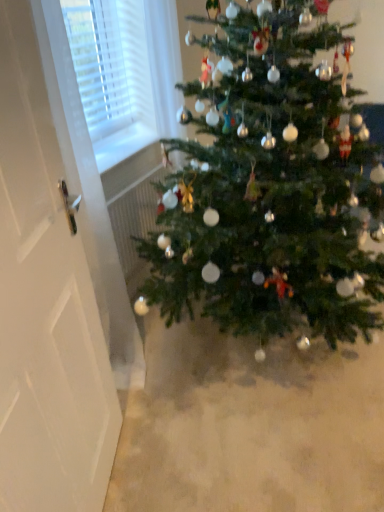
Question: From the image's perspective, is green matte christmas tree at center above white glossy door at left?

Choices:
 (A) no
 (B) yes

Answer: (B)

Question: From a real-world perspective, is green matte christmas tree at center physically above white glossy door at left?

Choices:
 (A) no
 (B) yes

Answer: (A)

Question: Considering the relative sizes of green matte christmas tree at center and white glossy door at left in the image provided, is green matte christmas tree at center thinner than white glossy door at left?

Choices:
 (A) yes
 (B) no

Answer: (B)

Question: Can you confirm if green matte christmas tree at center is positioned to the right of white glossy door at left?

Choices:
 (A) no
 (B) yes

Answer: (B)

Question: Is white glossy door at left inside green matte christmas tree at center?

Choices:
 (A) no
 (B) yes

Answer: (A)

Question: Is green matte christmas tree at center positioned with its back to white glossy door at left?

Choices:
 (A) no
 (B) yes

Answer: (A)

Question: From a real-world perspective, is white glossy door at left below green matte christmas tree at center?

Choices:
 (A) yes
 (B) no

Answer: (B)

Question: Does white glossy door at left have a smaller size compared to green matte christmas tree at center?

Choices:
 (A) yes
 (B) no

Answer: (A)

Question: Is white glossy door at left shorter than green matte christmas tree at center?

Choices:
 (A) no
 (B) yes

Answer: (A)

Question: Is white glossy door at left directly adjacent to green matte christmas tree at center?

Choices:
 (A) yes
 (B) no

Answer: (B)

Question: Is white glossy door at left surrounding green matte christmas tree at center?

Choices:
 (A) no
 (B) yes

Answer: (A)

Question: From a real-world perspective, is white glossy door at left positioned over green matte christmas tree at center based on gravity?

Choices:
 (A) yes
 (B) no

Answer: (A)

Question: From a real-world perspective, is green matte christmas tree at center above or below white glossy door at left?

Choices:
 (A) above
 (B) below

Answer: (B)